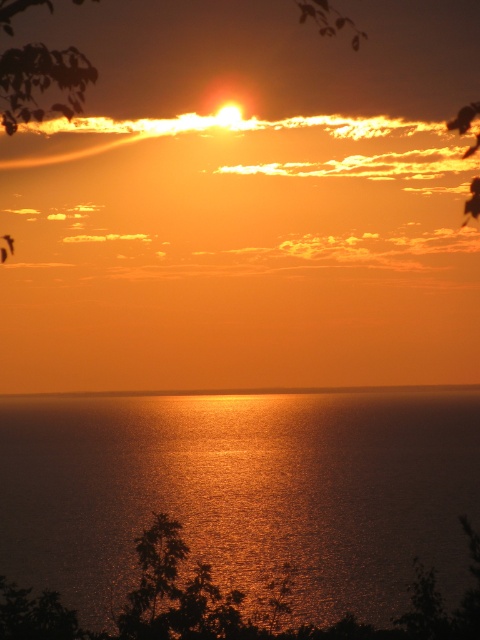
You are a photographer standing at the edge of the water. You want to capture the shiny golden water at center and the smooth orange sky at center in the same frame. Which object should you adjust your camera to focus on first if you want to ensure both are in the shot?

The shiny golden water at center is to the right of smooth orange sky at center. Since the photographer is at the edge of the water, focusing on the shiny golden water at center first would allow them to frame both objects as they are positioned horizontally adjacent to each other.

You are an artist trying to paint the sunset scene. You have two canvases of the same size. You want to paint the shiny golden water at center on one and the smooth orange sky at center on the other. Which canvas will require you to paint a wider area for its subject?

The smooth orange sky at center requires painting a wider area because its width is greater than the shiny golden water at center.

In the scene shown: You are a photographer standing at the edge of the water. You want to capture the reflection of the shiny golden water at center in your shot. Based on its position, where should you aim your camera? Please provide the coordinates as a point in the format like point X, Y.

The shiny golden water at center is located at point (241,490), so you should aim your camera at that coordinate to capture its reflection.